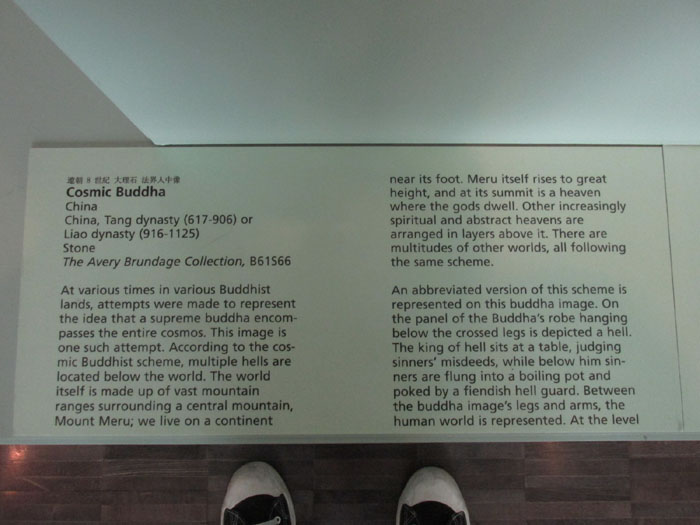
The height and width of the screenshot is (525, 700). Identify the location of white museum display information card. 154,238, 155,375, 474,400, 476,228.